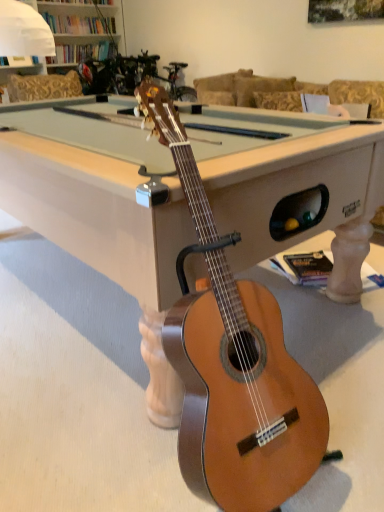
Question: Is point (284, 429) positioned closer to the camera than point (170, 274)?

Choices:
 (A) farther
 (B) closer

Answer: (B)

Question: In the image, is natural wood guitar at center positioned in front of or behind light wood billiard table at center?

Choices:
 (A) behind
 (B) front

Answer: (B)

Question: Looking at the image, does natural wood guitar at center seem bigger or smaller compared to light wood billiard table at center?

Choices:
 (A) small
 (B) big

Answer: (A)

Question: Is light wood billiard table at center in front of or behind natural wood guitar at center in the image?

Choices:
 (A) front
 (B) behind

Answer: (B)

Question: Based on their sizes in the image, would you say light wood billiard table at center is bigger or smaller than natural wood guitar at center?

Choices:
 (A) small
 (B) big

Answer: (B)

Question: Is light wood billiard table at center wider or thinner than natural wood guitar at center?

Choices:
 (A) thin
 (B) wide

Answer: (B)

Question: Is point (170, 293) closer or farther from the camera than point (177, 352)?

Choices:
 (A) farther
 (B) closer

Answer: (A)